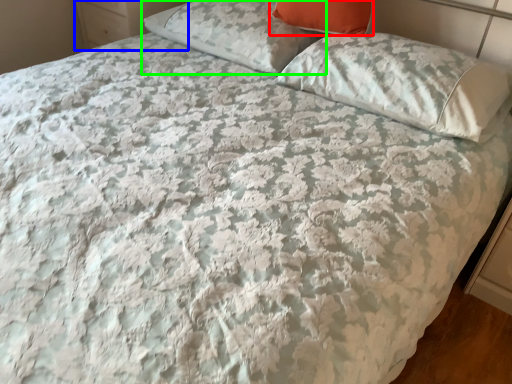
Question: Estimate the real-world distances between objects in this image. Which object is closer to pillow (highlighted by a red box), dresser (highlighted by a blue box) or pillow (highlighted by a green box)?

Choices:
 (A) dresser
 (B) pillow

Answer: (B)